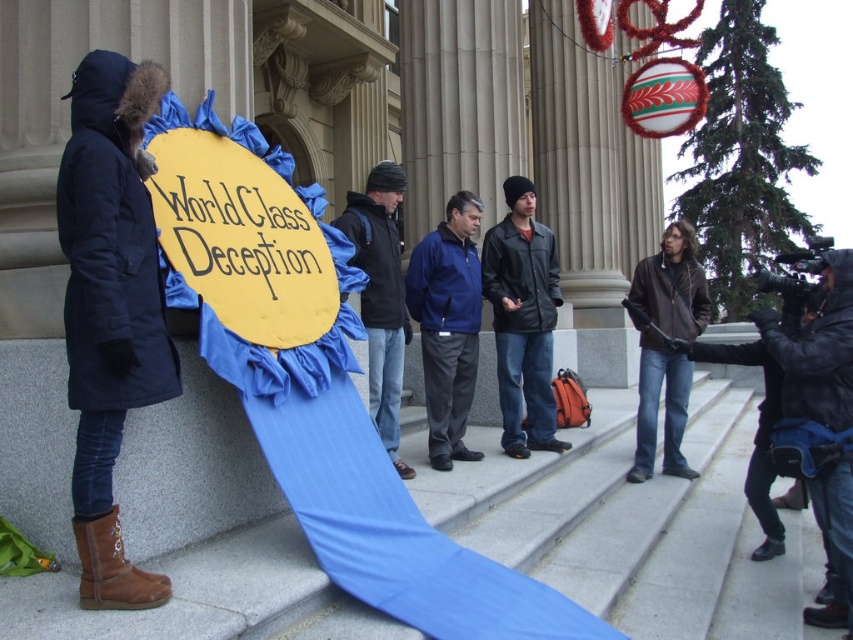
Question: Estimate the real-world distances between objects in this image. Which object is closer to the black fabric jacket at center?

Choices:
 (A) blue fabric sign at center
 (B) navy blue parka at left

Answer: (A)

Question: Does brown leather jacket at right appear over black fabric jacket at center?

Choices:
 (A) yes
 (B) no

Answer: (A)

Question: Is black leather jacket at right below black fabric jacket at center?

Choices:
 (A) no
 (B) yes

Answer: (A)

Question: Based on their relative distances, which object is nearer to the blue fabric sign at center?

Choices:
 (A) black fabric jacket at center
 (B) leather jacket at center
 (C) brown leather jacket at right
 (D) navy blue parka at left

Answer: (B)

Question: Estimate the real-world distances between objects in this image. Which object is farther from the navy blue parka at left?

Choices:
 (A) brown leather jacket at right
 (B) black leather jacket at right
 (C) black fabric jacket at center

Answer: (A)

Question: Is blue fabric sign at center positioned behind black fabric jacket at center?

Choices:
 (A) no
 (B) yes

Answer: (B)